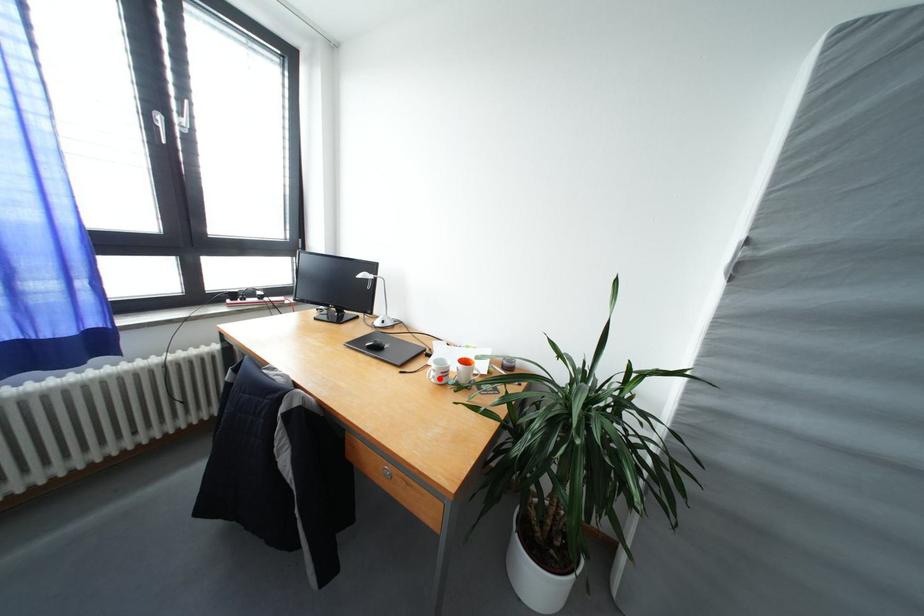
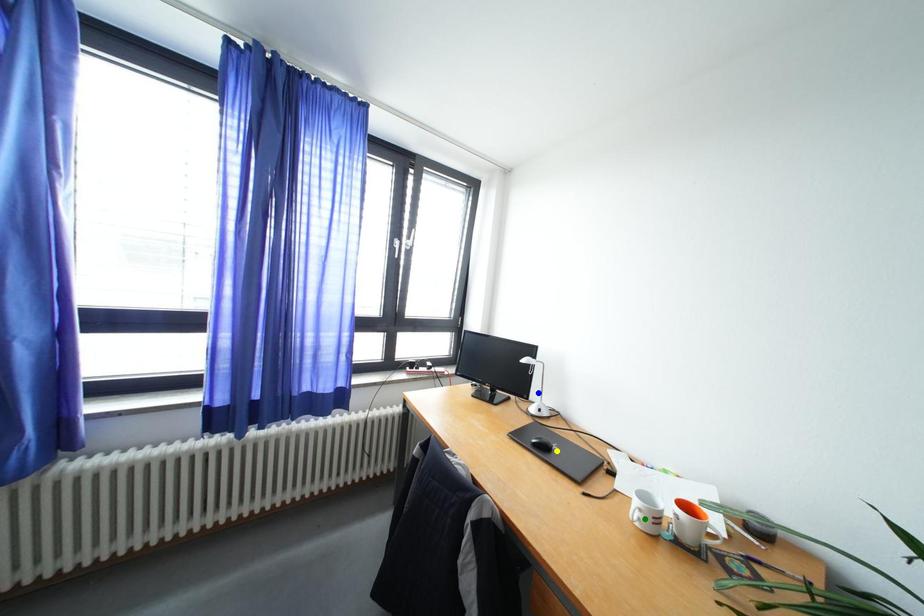
Question: I am providing you with two images of the same scene from different viewpoints. A red point is marked on the first image. You are given multiple points on the second image. Can you choose the point in image 2 that corresponds to the point in image 1?

Choices:
 (A) green point
 (B) yellow point
 (C) blue point

Answer: (A)